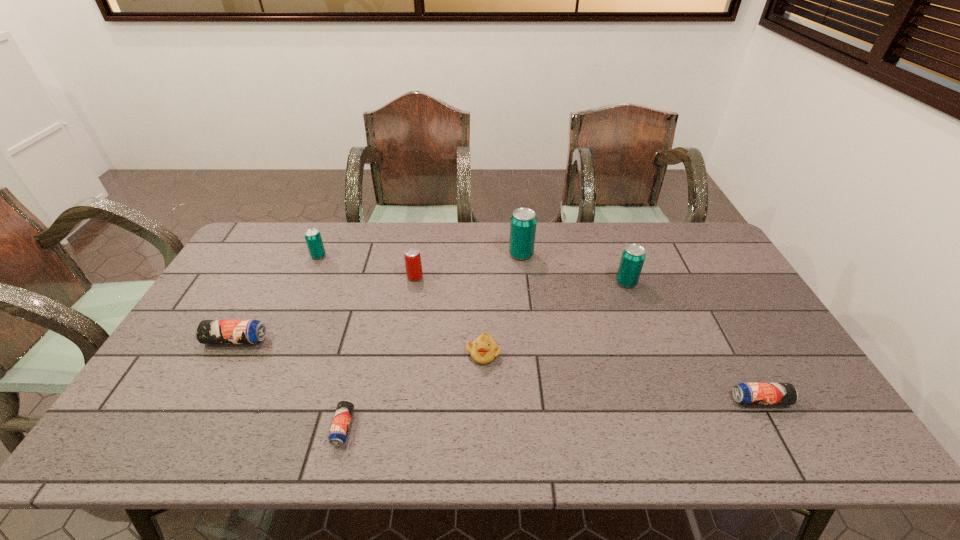
The width and height of the screenshot is (960, 540). In order to click on vacant area at the far left corner in this screenshot , I will do click(295, 225).

In the image, there is a desktop. Identify the location of vacant space at the near left corner. [x=138, y=430].

You are a GUI agent. You are given a task and a screenshot of the screen. Output one action in this format:
    pyautogui.click(x=<x>, y=<y>)
    Task: Click on the free space at the far right corner of the desktop
    This screenshot has width=960, height=540.
    Given the screenshot: What is the action you would take?
    pyautogui.click(x=669, y=226)

You are a GUI agent. You are given a task and a screenshot of the screen. Output one action in this format:
    pyautogui.click(x=<x>, y=<y>)
    Task: Click on the vacant space in between the seventh object from right to left and the second shortest object
    
    Given the screenshot: What is the action you would take?
    click(540, 328)

I want to click on free space between the second blue beer can from right to left and the fourth beer can from left to right, so click(x=379, y=352).

The width and height of the screenshot is (960, 540). I want to click on free space between the duckling and the second tallest object, so click(555, 318).

You are a GUI agent. You are given a task and a screenshot of the screen. Output one action in this format:
    pyautogui.click(x=<x>, y=<y>)
    Task: Click on the blank region between the nearest teal beer can and the farthest blue beer can
    This screenshot has height=540, width=960.
    Given the screenshot: What is the action you would take?
    pyautogui.click(x=431, y=311)

Where is `free space between the leftmost teal beer can and the shortest beer can`? Image resolution: width=960 pixels, height=540 pixels. free space between the leftmost teal beer can and the shortest beer can is located at coordinates (331, 342).

You are a GUI agent. You are given a task and a screenshot of the screen. Output one action in this format:
    pyautogui.click(x=<x>, y=<y>)
    Task: Click on the vacant space in between the tallest beer can and the rightmost beer can
    The width and height of the screenshot is (960, 540).
    Given the screenshot: What is the action you would take?
    pyautogui.click(x=640, y=327)

Image resolution: width=960 pixels, height=540 pixels. I want to click on free area in between the seventh object from left to right and the tallest beer can, so click(574, 268).